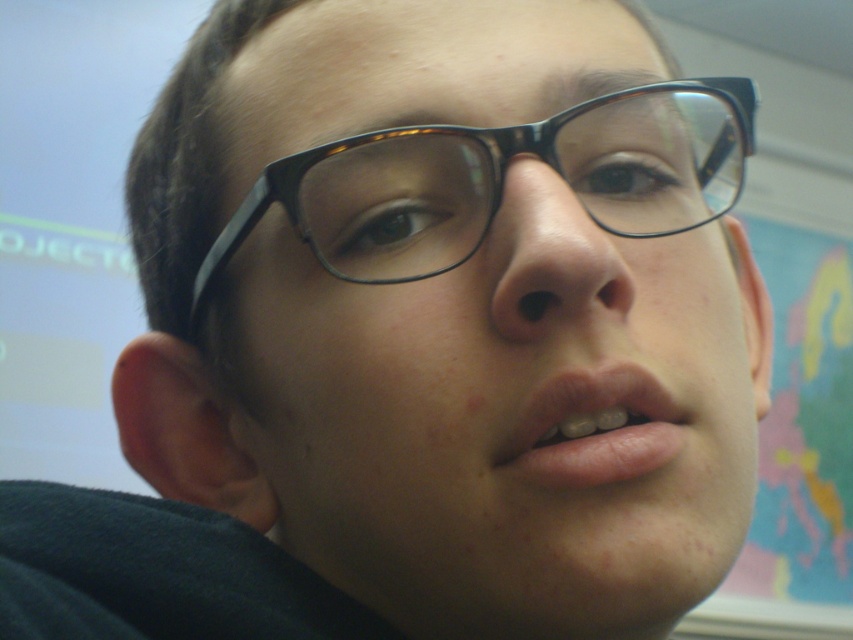
Question: Does matte skin nose at center lie in front of pink matte lips at center?

Choices:
 (A) no
 (B) yes

Answer: (B)

Question: Is black acetate glasses at center thinner than pink matte lips at center?

Choices:
 (A) yes
 (B) no

Answer: (B)

Question: Which of the following is the closest to the observer?

Choices:
 (A) (616, 435)
 (B) (520, 128)
 (C) (560, 476)

Answer: (C)

Question: Among these objects, which one is nearest to the camera?

Choices:
 (A) black acetate glasses at center
 (B) matte skin nose at center
 (C) matte black glasses at center

Answer: (C)

Question: Is matte black glasses at center thinner than black acetate glasses at center?

Choices:
 (A) yes
 (B) no

Answer: (B)

Question: Which is farther from the matte black glasses at center?

Choices:
 (A) pink matte lips at center
 (B) matte skin nose at center
 (C) black acetate glasses at center

Answer: (A)